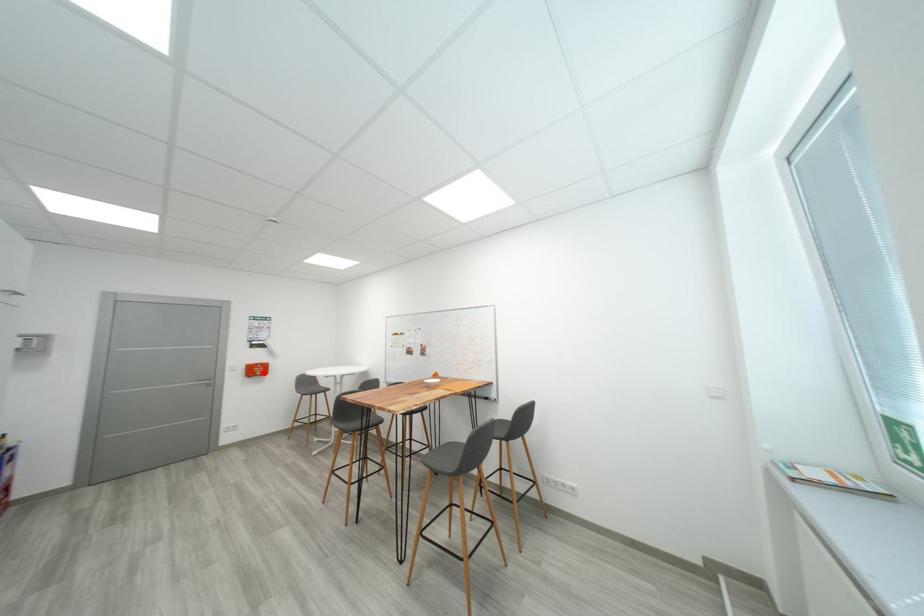
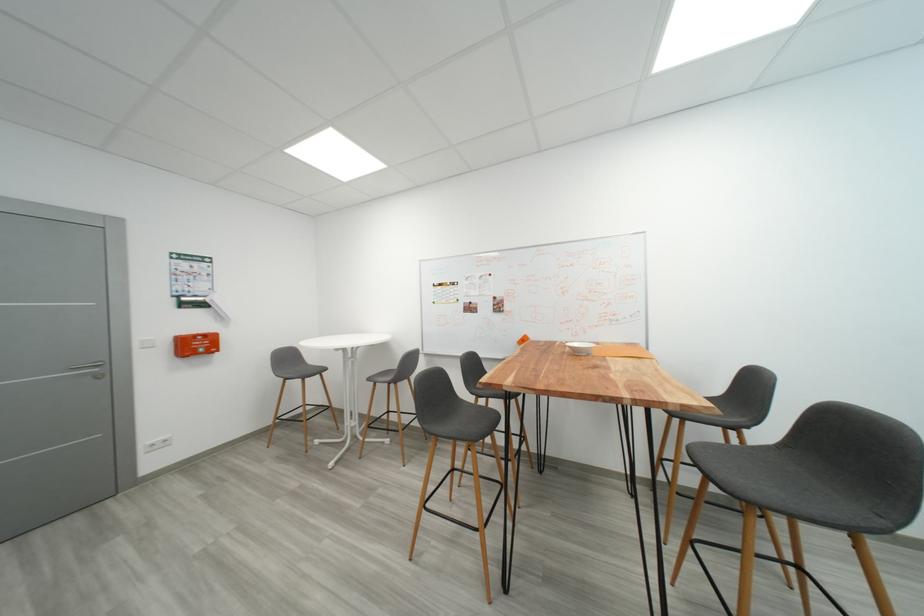
Question: I am providing you with two images of the same scene from different viewpoints. Image1 has a red point marked. In image2, the corresponding 3D location appears at what relative position? Reply with the corresponding letter.

Choices:
 (A) Closer
 (B) Farther

Answer: (A)